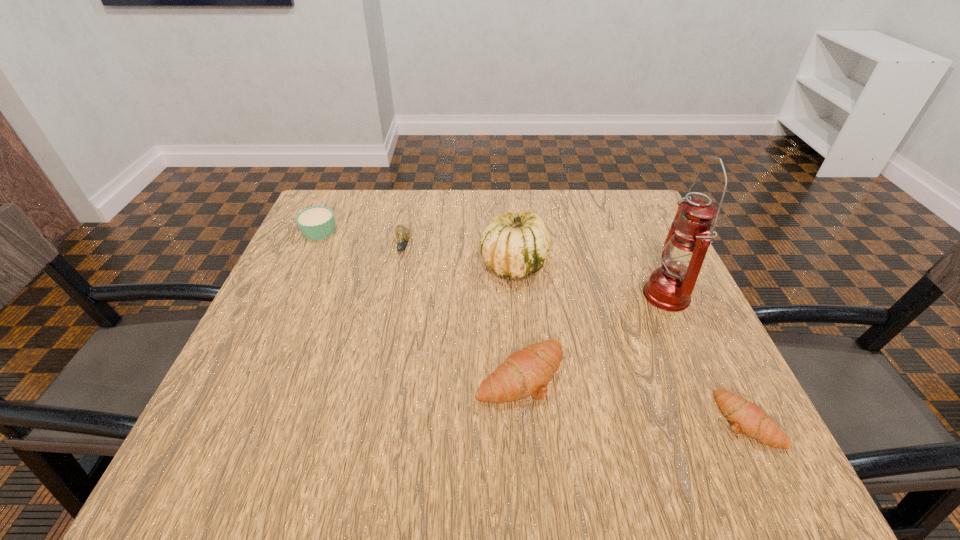
Given the evenly spaced crescent rolls in the image, where should an extra crescent roll be added on the left to preserve the spacing? Please point to a vacant space. Please provide its 2D coordinates. Your answer should be formatted as a tuple, i.e. [(x, y)], where the tuple contains the x and y coordinates of a point satisfying the conditions above.

[(327, 335)]